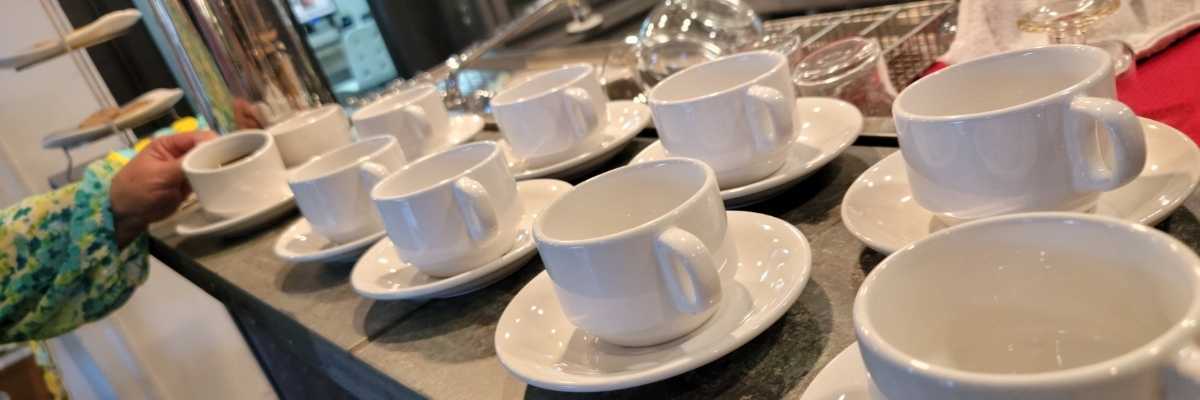
Where is `handles`? This screenshot has width=1200, height=400. handles is located at coordinates (582, 107), (774, 99), (1128, 141), (1190, 376), (690, 261), (473, 200), (371, 167), (414, 111).